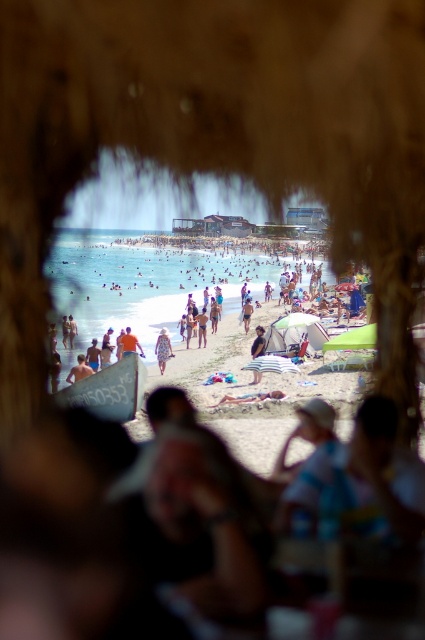
Identify the location of white cotton dress at center. The height and width of the screenshot is (640, 425). (201, 326).

Does white cotton dress at center have a greater height compared to blue fabric umbrella at center?

No, white cotton dress at center is not taller than blue fabric umbrella at center.

This screenshot has height=640, width=425. Identify the location of white cotton dress at center. (201, 326).

Where is `white cotton dress at center`? The width and height of the screenshot is (425, 640). white cotton dress at center is located at coordinates (201, 326).

Between white fabric towel at center and striped fabric person at center, which one has more height?

striped fabric person at center is taller.

Is white fabric towel at center thinner than striped fabric person at center?

No, white fabric towel at center is not thinner than striped fabric person at center.

Is point (266, 396) behind point (265, 340)?

No, it is not.

At what (x,y) coordinates should I click in order to perform the action: click on white fabric towel at center. Please return your answer as a coordinate pair (x, y). Looking at the image, I should click on coord(251,397).

Does striped fabric person at center appear on the left side of tan skin person at lower left?

No, striped fabric person at center is not to the left of tan skin person at lower left.

Consider the image. Is striped fabric person at center taller than tan skin person at lower left?

Correct, striped fabric person at center is much taller as tan skin person at lower left.

Who is more distant from viewer, (257, 349) or (73, 380)?

The point (257, 349) is behind.

The height and width of the screenshot is (640, 425). I want to click on striped fabric person at center, so click(257, 342).